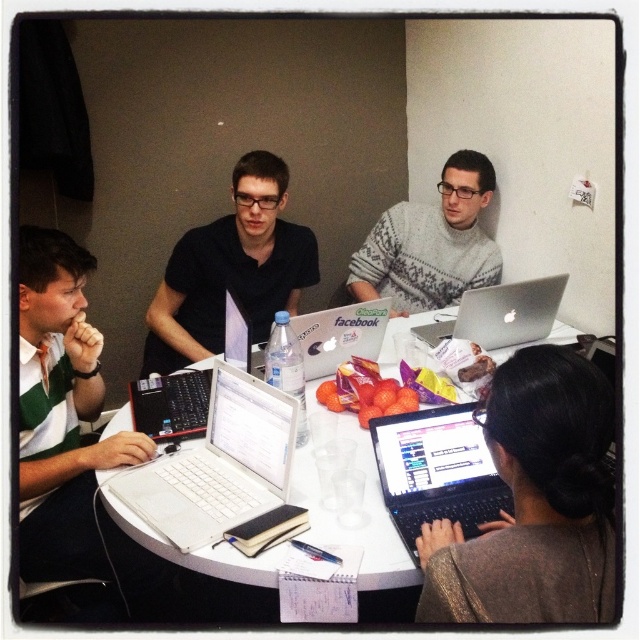
Between matte black shirt at center and silver metallic laptop at upper right, which one is positioned lower?

Positioned lower is silver metallic laptop at upper right.

Between point (228, 256) and point (433, 340), which one is positioned in front?

Point (433, 340) is more forward.

This screenshot has width=640, height=640. What are the coordinates of `matte black shirt at center` in the screenshot? It's located at (230, 269).

This screenshot has height=640, width=640. In order to click on matte black shirt at center in this screenshot , I will do `click(230, 269)`.

Between matte black shirt at center and white plastic table at center, which one is positioned lower?

white plastic table at center is below.

Between matte black shirt at center and white plastic table at center, which one appears on the left side from the viewer's perspective?

From the viewer's perspective, matte black shirt at center appears more on the left side.

Between point (168, 333) and point (218, 573), which one is positioned in front?

Point (218, 573) is more forward.

This screenshot has height=640, width=640. What are the coordinates of `matte black shirt at center` in the screenshot? It's located at (230, 269).

Who is more distant from viewer, (280, 486) or (433, 470)?

The point (433, 470) is behind.

Which is below, white matte laptop at center or black plastic laptop at lower center?

black plastic laptop at lower center is lower down.

The width and height of the screenshot is (640, 640). Identify the location of white matte laptop at center. (218, 465).

This screenshot has height=640, width=640. I want to click on white matte laptop at center, so click(218, 465).